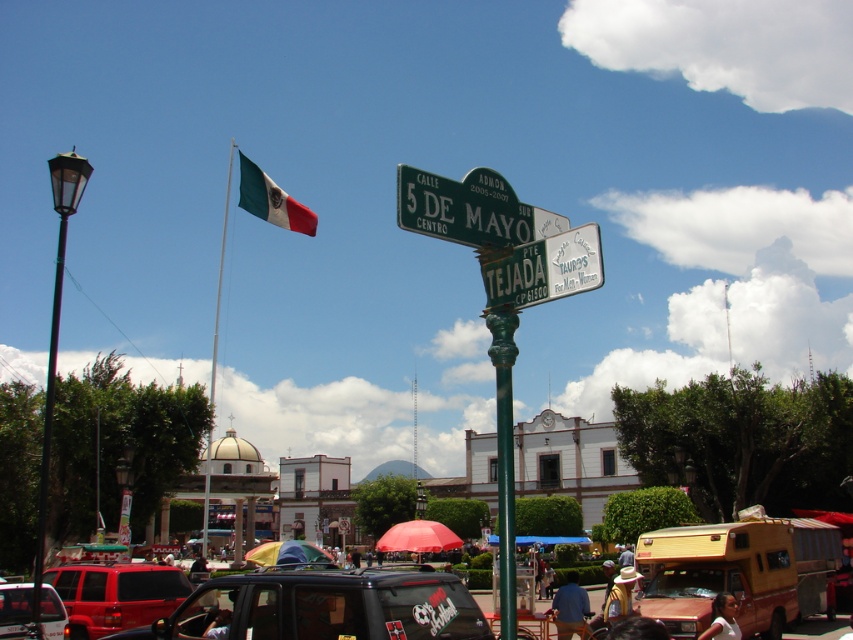
Question: Estimate the real-world distances between objects in this image. Which object is farther from the green metallic street sign at upper center?

Choices:
 (A) green glass lamp post at left
 (B) matte red umbrella at center
 (C) green and white striped flag at upper left
 (D) rainbow fabric umbrella at center

Answer: (A)

Question: Which object is farther from the camera taking this photo?

Choices:
 (A) matte black car at lower left
 (B) metallic green street sign at upper center

Answer: (A)

Question: Is green glass lamp post at left behind matte red umbrella at center?

Choices:
 (A) no
 (B) yes

Answer: (A)

Question: Can you confirm if green metallic street sign at upper center is positioned to the right of matte red suv at center?

Choices:
 (A) yes
 (B) no

Answer: (A)

Question: Estimate the real-world distances between objects in this image. Which object is closer to the green glass lamp post at left?

Choices:
 (A) rainbow fabric umbrella at center
 (B) green painted metal pole at center
 (C) green metallic street sign at upper center
 (D) metallic green street sign at upper center

Answer: (A)

Question: Is matte red suv at center bigger than green and white striped flag at upper left?

Choices:
 (A) yes
 (B) no

Answer: (B)